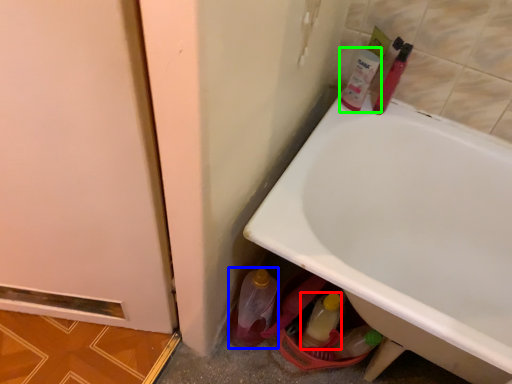
Question: Based on their relative distances, which object is nearer to bottle (highlighted by a red box)? Choose from bottle (highlighted by a blue box) and mouthwash (highlighted by a green box).

Choices:
 (A) bottle
 (B) mouthwash

Answer: (A)